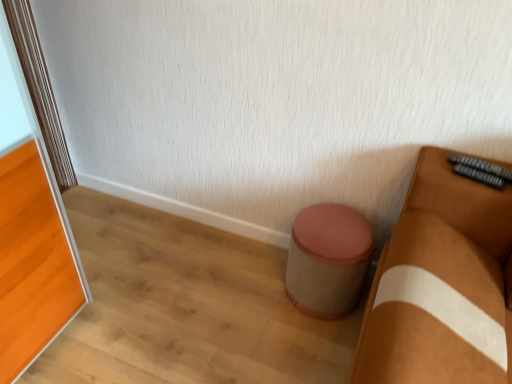
Find the location of `vacant space situated above beige fabric stool at center (from a real-world perspective)`. vacant space situated above beige fabric stool at center (from a real-world perspective) is located at coordinates (329, 226).